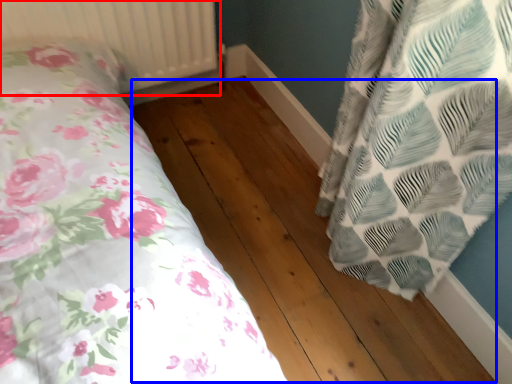
Question: Which point is closer to the camera, radiator (highlighted by a red box) or hardwood (highlighted by a blue box)?

Choices:
 (A) radiator
 (B) hardwood

Answer: (B)